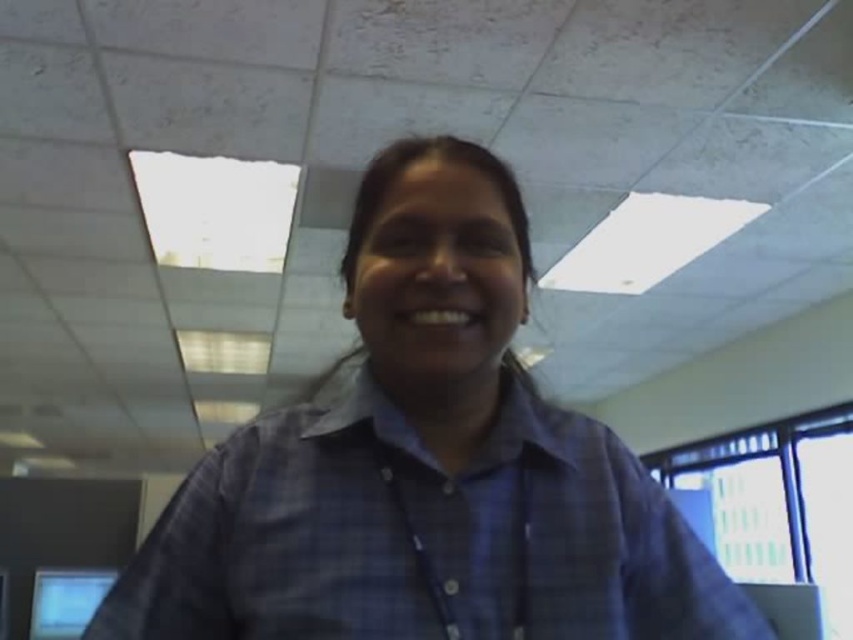
Describe the element at coordinates (426, 467) in the screenshot. I see `blue plaid shirt at center` at that location.

Who is higher up, blue plaid shirt at center or matte black monitor at lower left?

blue plaid shirt at center is above.

Is point (621, 477) farther from viewer compared to point (39, 596)?

No, (621, 477) is in front of (39, 596).

Where is `blue plaid shirt at center`? blue plaid shirt at center is located at coordinates (426, 467).